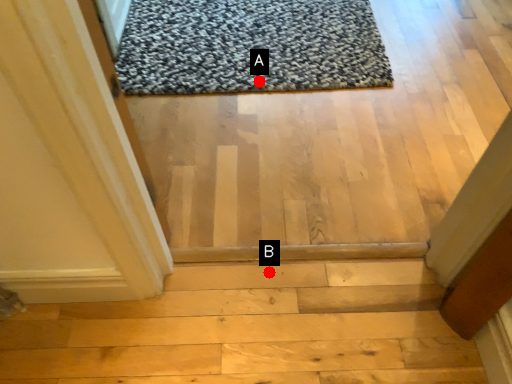
Question: Two points are circled on the image, labeled by A and B beside each circle. Which point is further to the camera?

Choices:
 (A) A is further
 (B) B is further

Answer: (A)